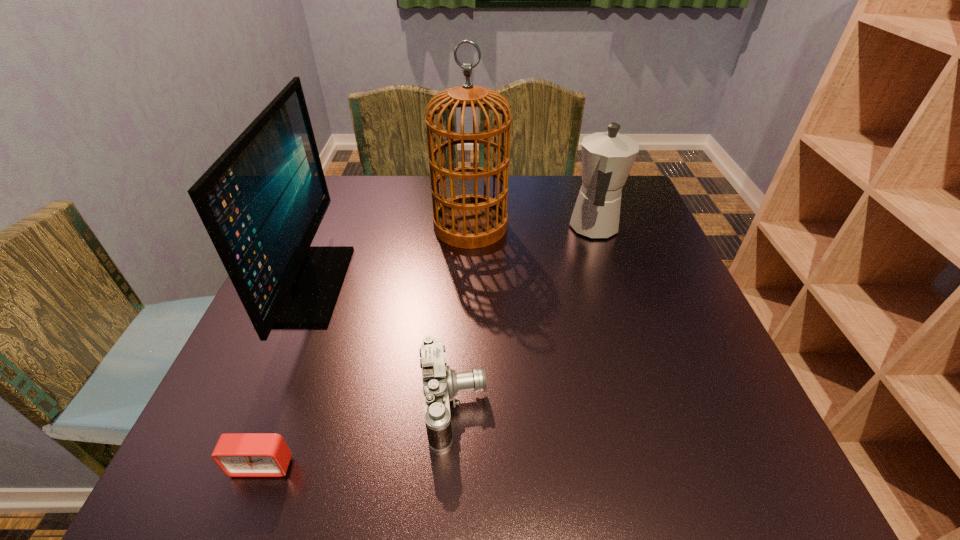
Locate an element on the screen. The height and width of the screenshot is (540, 960). birdcage that is at the far edge is located at coordinates (467, 221).

This screenshot has width=960, height=540. In order to click on coffeepot located in the far edge section of the desktop in this screenshot , I will do `click(607, 157)`.

The image size is (960, 540). I want to click on camera located at the near edge, so click(441, 384).

This screenshot has width=960, height=540. I want to click on alarm clock located in the near edge section of the desktop, so click(x=237, y=454).

Find the location of a particular element. monitor present at the left edge is located at coordinates (262, 201).

Where is `alarm clock located at the left edge`? Image resolution: width=960 pixels, height=540 pixels. alarm clock located at the left edge is located at coordinates (237, 454).

Identify the location of object at the right edge. The image size is (960, 540). (607, 157).

Image resolution: width=960 pixels, height=540 pixels. Find the location of `object present at the near left corner`. object present at the near left corner is located at coordinates (237, 454).

The image size is (960, 540). Identify the location of object at the far right corner. (607, 157).

Locate an element on the screen. This screenshot has height=540, width=960. free location at the far edge is located at coordinates (381, 207).